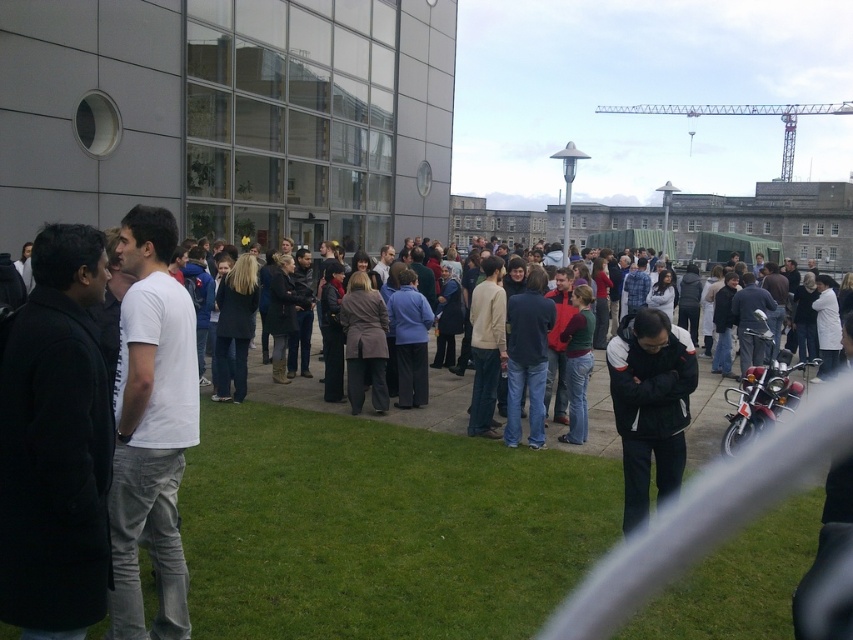
Between dark gray wool coat at left and white cotton t-shirt at left, which one appears on the right side from the viewer's perspective?

Positioned to the right is white cotton t-shirt at left.

Is dark gray wool coat at left smaller than white cotton t-shirt at left?

Indeed, dark gray wool coat at left has a smaller size compared to white cotton t-shirt at left.

Locate an element on the screen. dark gray wool coat at left is located at coordinates (55, 444).

Find the location of `dark gray wool coat at left`. dark gray wool coat at left is located at coordinates click(55, 444).

Is green grass at lower center positioned in front of white cotton t-shirt at left?

No, it is not.

How far apart are green grass at lower center and white cotton t-shirt at left?

The distance of green grass at lower center from white cotton t-shirt at left is 14.37 feet.

The height and width of the screenshot is (640, 853). Identify the location of green grass at lower center. (381, 529).

Which is below, green grass at lower center or black fleece jacket at center?

green grass at lower center

Does green grass at lower center have a lesser height compared to black fleece jacket at center?

Correct, green grass at lower center is not as tall as black fleece jacket at center.

Is point (807, 500) closer to camera compared to point (686, 419)?

That is False.

I want to click on green grass at lower center, so click(x=381, y=529).